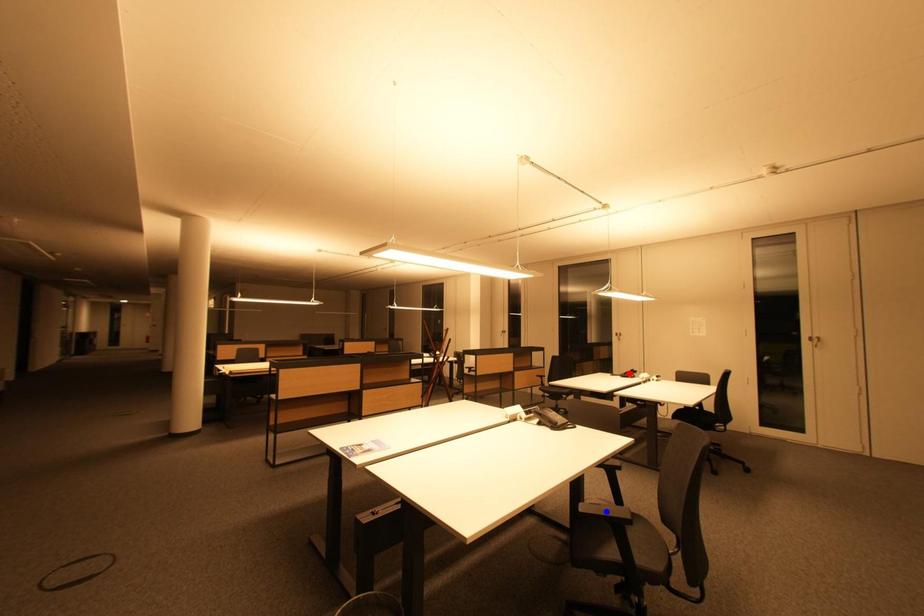
Question: Which of the two points in the image is closer to the camera?

Choices:
 (A) Blue point is closer.
 (B) Red point is closer.

Answer: (A)